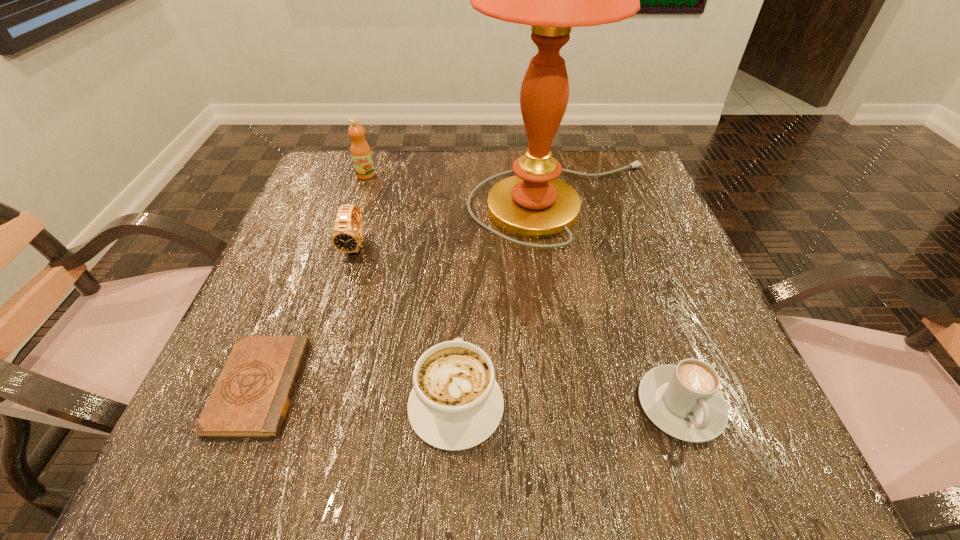
Where is `vacant space located to the right of the left cappuccino's handle`? The width and height of the screenshot is (960, 540). vacant space located to the right of the left cappuccino's handle is located at coordinates (462, 257).

At what (x,y) coordinates should I click in order to perform the action: click on free space located to the right of the left cappuccino's handle. Please return your answer as a coordinate pair (x, y). Image resolution: width=960 pixels, height=540 pixels. Looking at the image, I should click on (464, 228).

The width and height of the screenshot is (960, 540). I want to click on vacant space situated 0.380m to the right of the left cappuccino's handle, so click(x=464, y=213).

Where is `free spot located on the spine side of the shortest object`? This screenshot has height=540, width=960. free spot located on the spine side of the shortest object is located at coordinates (330, 386).

Where is `lamp located in the far edge section of the desktop`? This screenshot has height=540, width=960. lamp located in the far edge section of the desktop is located at coordinates (534, 204).

At what (x,y) coordinates should I click in order to perform the action: click on orange juice at the far edge. Please return your answer as a coordinate pair (x, y). Looking at the image, I should click on (361, 155).

What are the coordinates of `diary that is at the near edge` in the screenshot? It's located at (251, 398).

Identify the location of orange juice that is positioned at the left edge. (361, 155).

You are a GUI agent. You are given a task and a screenshot of the screen. Output one action in this format:
    pyautogui.click(x=<x>, y=<y>)
    Task: Click on the watch at the left edge
    The width and height of the screenshot is (960, 540).
    Given the screenshot: What is the action you would take?
    pyautogui.click(x=347, y=236)

Locate an element on the screen. diary that is positioned at the left edge is located at coordinates (251, 398).